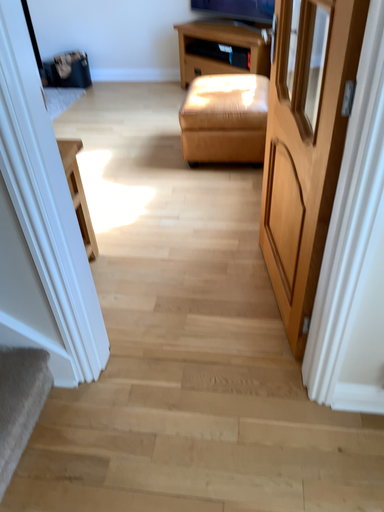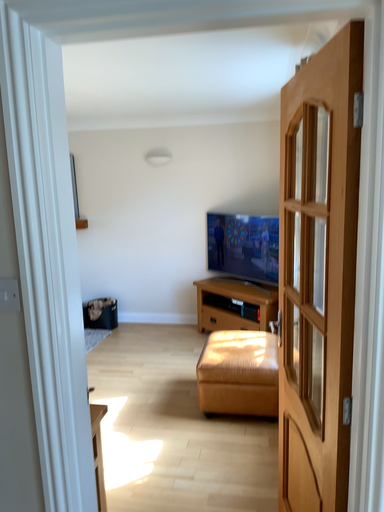
Question: How did the camera likely rotate when shooting the video?

Choices:
 (A) rotated downward
 (B) rotated upward

Answer: (B)